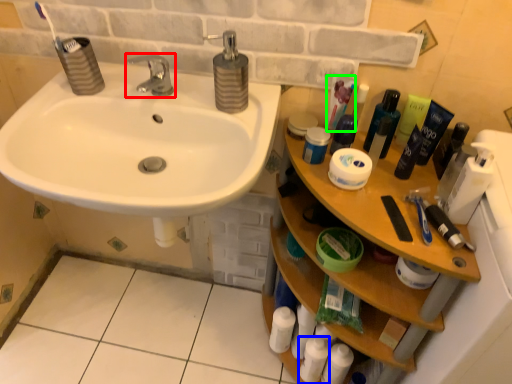
Question: Which object is the closest to the tap (highlighted by a red box)? Choose among these: toiletry (highlighted by a blue box) or toothpaste (highlighted by a green box).

Choices:
 (A) toiletry
 (B) toothpaste

Answer: (B)